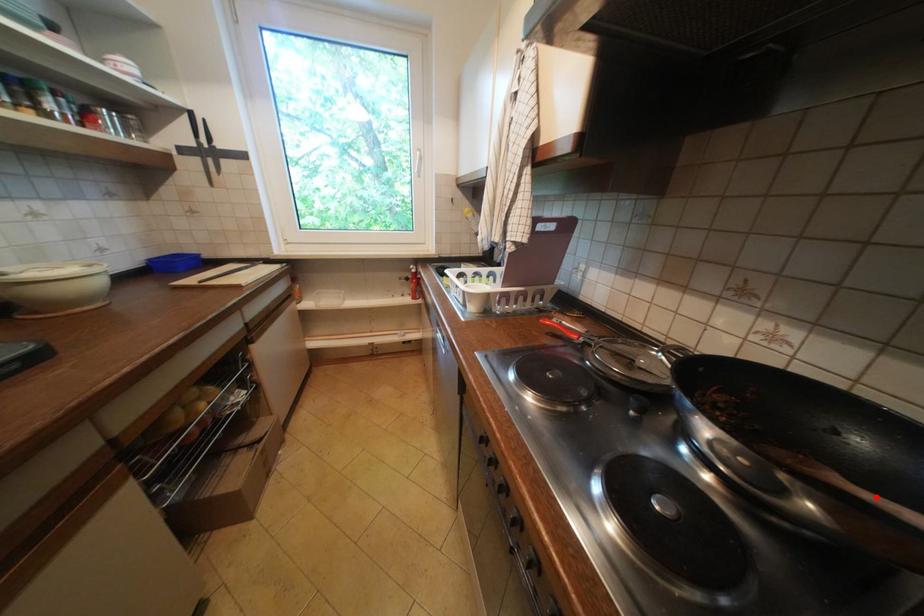
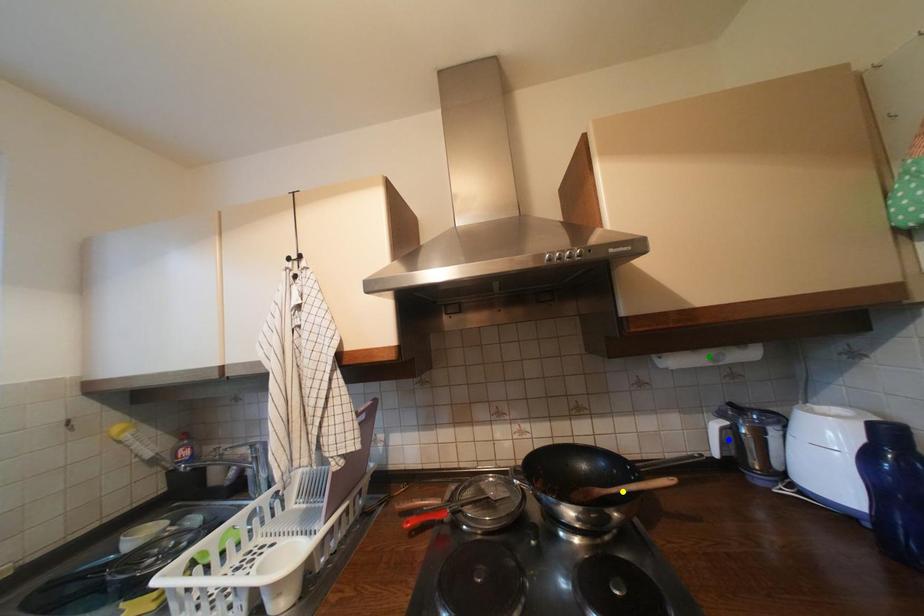
Question: I am providing you with two images of the same scene from different viewpoints. A red point is marked on the first image. You are given multiple points on the second image. Which point in image 2 is actually the same real-world point as the red point in image 1?

Choices:
 (A) yellow point
 (B) green point
 (C) blue point

Answer: (A)